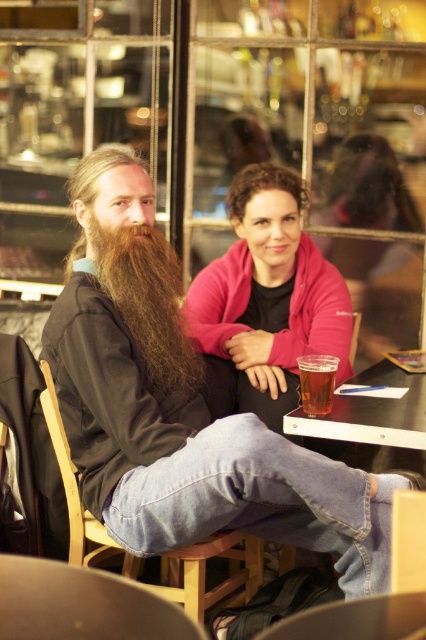
Question: Estimate the real-world distances between objects in this image. Which object is closer to the matte black jacket at left?

Choices:
 (A) wooden chair at lower left
 (B) translucent plastic cup at lower center
 (C) pink fleece at center
 (D) clear plastic cup at lower center

Answer: (A)

Question: Does wooden chair at lower left appear on the left side of translucent plastic cup at lower center?

Choices:
 (A) yes
 (B) no

Answer: (A)

Question: Does pink fleece at center lie behind wooden chair at lower left?

Choices:
 (A) no
 (B) yes

Answer: (B)

Question: Can you confirm if pink fleece at center is positioned above long brown hair at left?

Choices:
 (A) no
 (B) yes

Answer: (B)

Question: Which point is closer to the camera taking this photo?

Choices:
 (A) (321, 396)
 (B) (393, 372)

Answer: (A)

Question: Which object is positioned closest to the long brown hair at left?

Choices:
 (A) translucent plastic cup at lower center
 (B) pink fleece at center
 (C) clear plastic cup at lower center
 (D) wooden chair at lower left

Answer: (B)